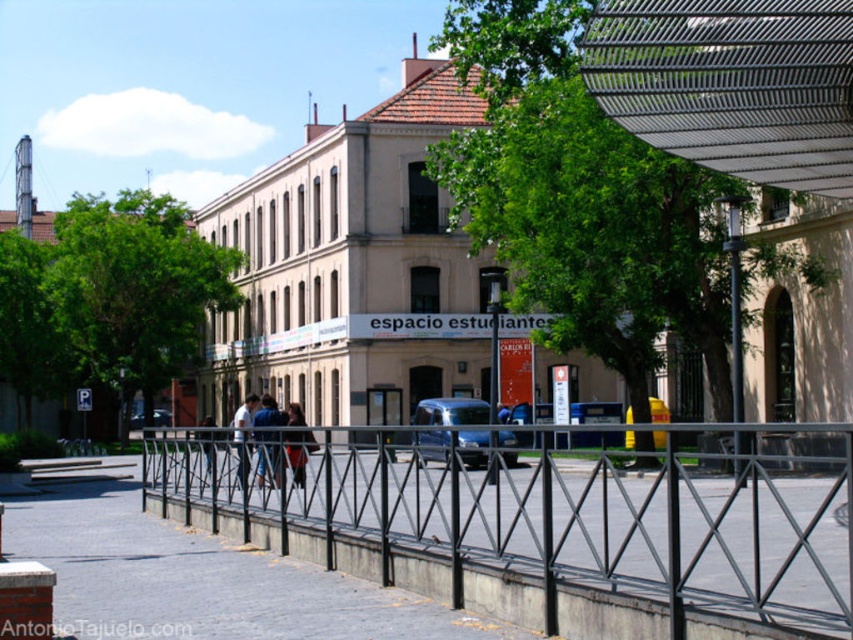
You are a photographer trying to capture both the blue denim jeans at center and the dark brown leather jacket at center in a single frame. Since you want to ensure both are clearly visible, which object should you focus on first to avoid blurring due to their size difference?

The blue denim jeans at center is thinner than the dark brown leather jacket at center, so you should focus on the blue denim jeans at center first as it is smaller and requires precise focus to capture details clearly.

You are standing in front of the beige building with a red roof and want to cross to the other side. There is a light blue jeans at center and a metallic silver car at center in your path. Which object should you move around to reach the other side?

The light blue jeans at center is in front of the metallic silver car at center, so you should move around the light blue jeans at center to reach the other side.